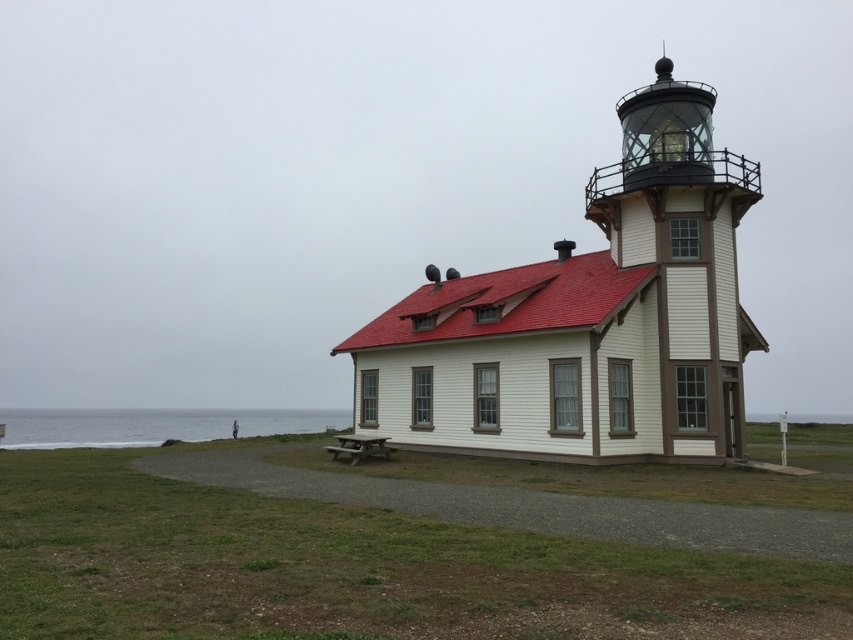
Question: Which point appears closest to the camera in this image?

Choices:
 (A) (143, 410)
 (B) (682, 388)
 (C) (357, 456)

Answer: (B)

Question: Does gray water at lower left appear under wooden picnic table at center?

Choices:
 (A) yes
 (B) no

Answer: (A)

Question: Estimate the real-world distances between objects in this image. Which object is farther from the matte white tower at center?

Choices:
 (A) wooden picnic table at center
 (B) gray water at lower left

Answer: (B)

Question: Can you confirm if gray water at lower left is thinner than wooden picnic table at center?

Choices:
 (A) no
 (B) yes

Answer: (A)

Question: Which point appears closest to the camera in this image?

Choices:
 (A) (270, 429)
 (B) (631, 132)

Answer: (B)

Question: Does matte white tower at center have a lesser width compared to gray water at lower left?

Choices:
 (A) no
 (B) yes

Answer: (B)